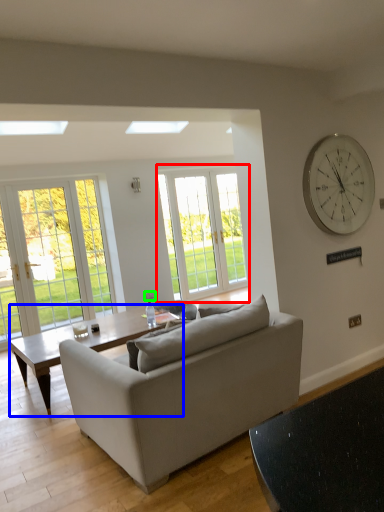
Question: Which object is positioned farthest from window (highlighted by a red box)? Select from coffee table (highlighted by a blue box) and power outlet (highlighted by a green box).

Choices:
 (A) coffee table
 (B) power outlet

Answer: (A)